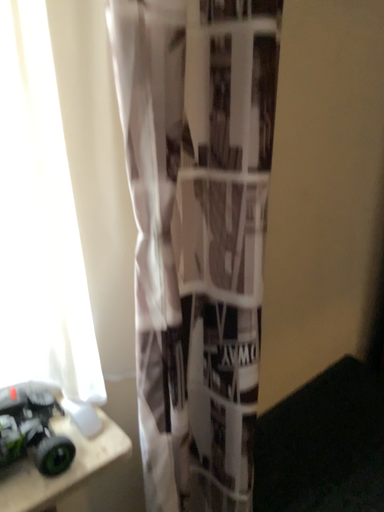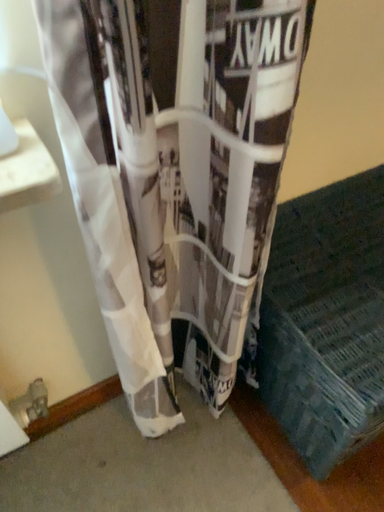
Question: How did the camera likely rotate when shooting the video?

Choices:
 (A) rotated left
 (B) rotated right

Answer: (A)